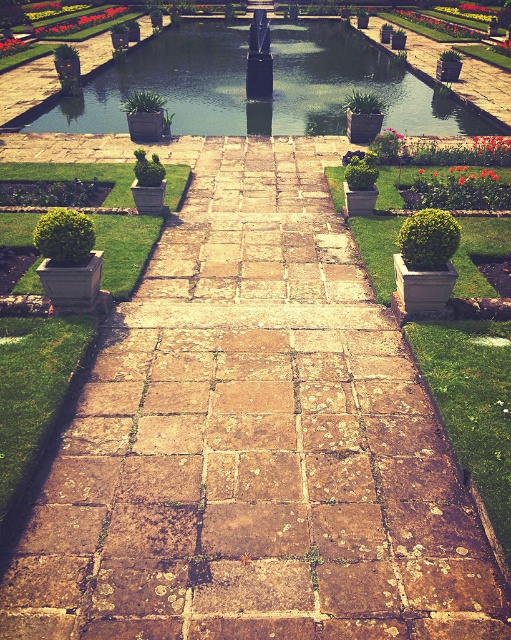
You are a gardener planning to place a new decorative item exactly at the center of the garden pathway. The item you have is 1 meter wide. Considering the existing green stone waterway at center and red glossy tulip at center, will there be enough space for your item without overlapping either of them?

The green stone waterway at center is wider than the red glossy tulip at center. Since the waterway is wider, the space required for the new item must accommodate its width. However, the exact widths are not provided, so it is uncertain if 1 meter will suffice. Please check the actual dimensions of the waterway and tulip to ensure compatibility.

You are a gardener planning to place a new decorative statue that is 1.2 meters tall. You want to ensure it is visible from both ends of the garden pathway. Which object should you place it near to ensure visibility, the green stone waterway at center or the green leafy plant at upper left?

The green stone waterway at center has a larger size compared to the green leafy plant at upper left. Placing the statue near the green stone waterway at center would provide better visibility from both ends of the pathway due to its larger size and central position.